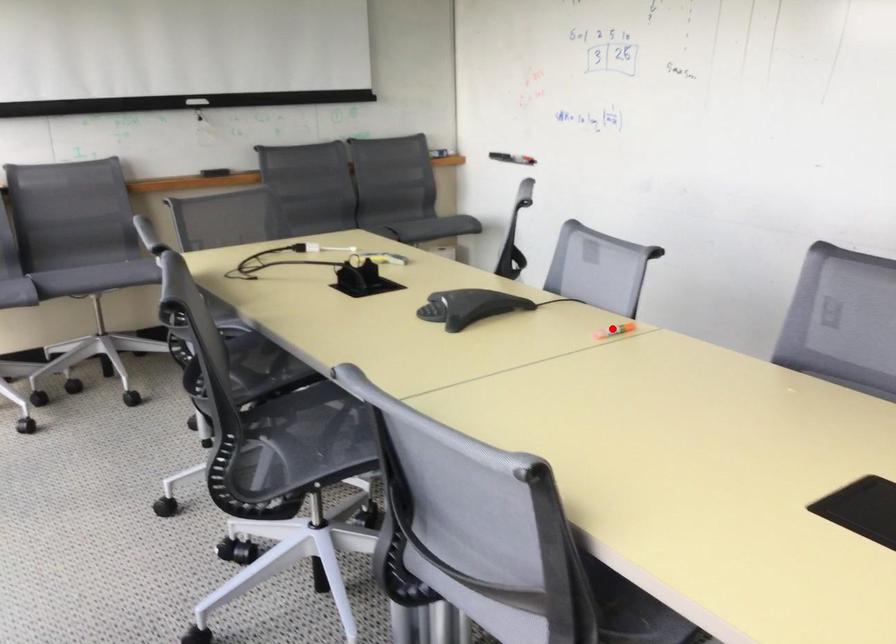
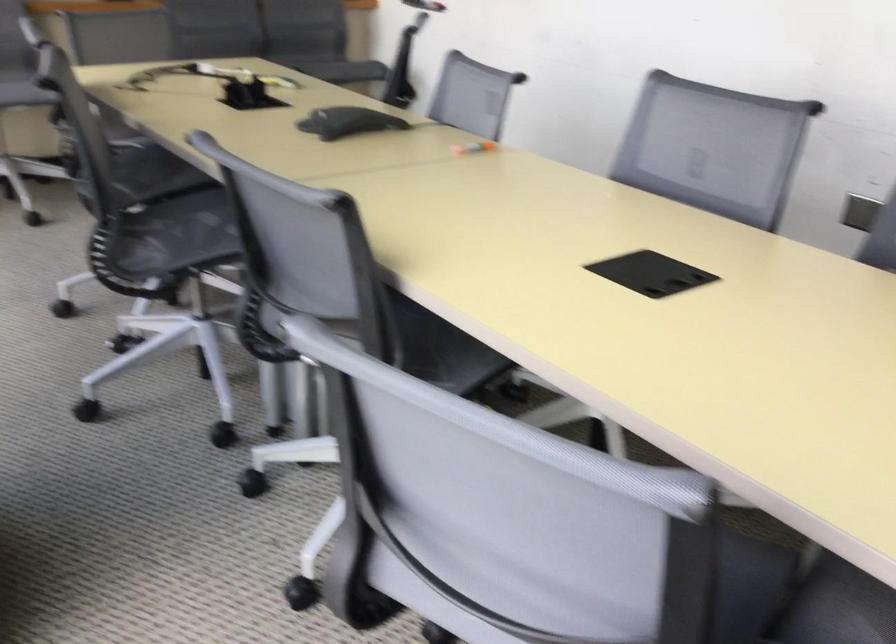
Find the pixel in the second image that matches the highlighted location in the first image.

(474, 147)